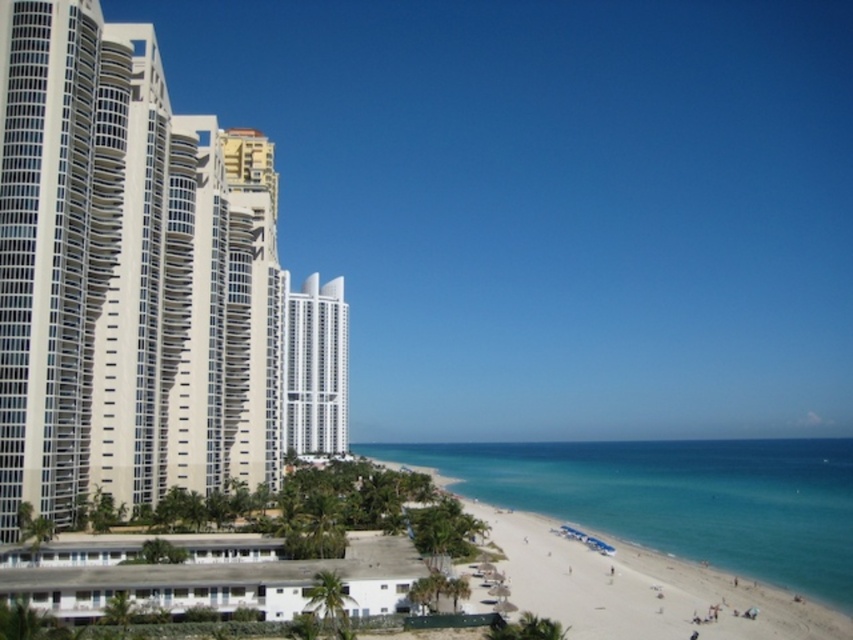
Is white glass building at left smaller than white glossy building at center?

Actually, white glass building at left might be larger than white glossy building at center.

Based on the photo, does white glass building at left appear on the left side of white glossy building at center?

In fact, white glass building at left is to the right of white glossy building at center.

Between point (86, 349) and point (288, 428), which one is positioned behind?

The point (288, 428) is more distant.

Locate an element on the screen. Image resolution: width=853 pixels, height=640 pixels. white glass building at left is located at coordinates (142, 284).

Consider the image. Is clear blue water at beach right thinner than white glossy building at center?

No, clear blue water at beach right is not thinner than white glossy building at center.

Is point (735, 461) positioned behind point (286, 380)?

That is True.

What are the coordinates of `clear blue water at beach right` in the screenshot? It's located at (677, 497).

Is white glass building at left further to camera compared to clear blue water at beach right?

No, it is not.

Who is more distant from viewer, (143, 404) or (772, 490)?

Answer: The point (772, 490) is behind.

From the picture: Who is more forward, (169, 131) or (811, 468)?

Point (169, 131)

This screenshot has height=640, width=853. I want to click on white glass building at left, so click(x=142, y=284).